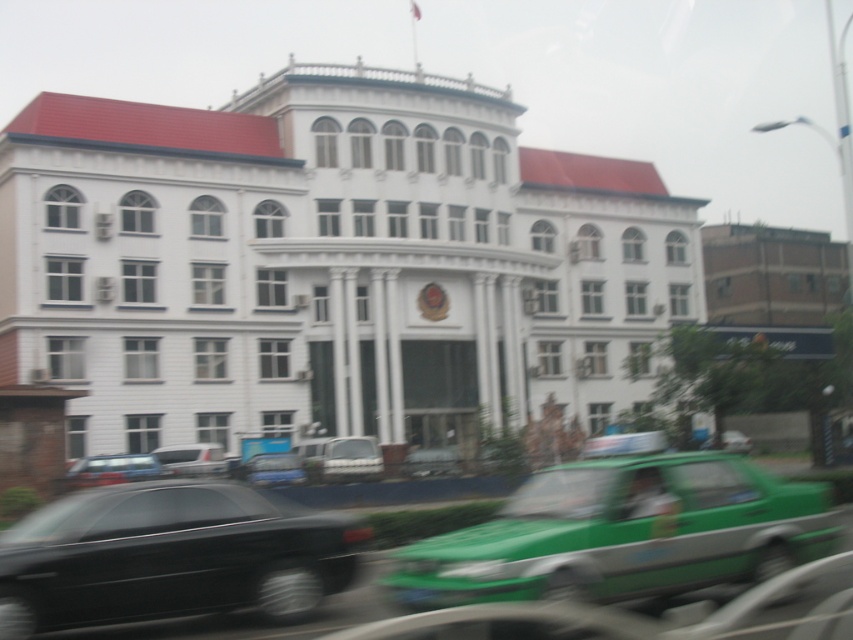
Question: Estimate the real-world distances between objects in this image. Which object is closer to the green matte car at center?

Choices:
 (A) shiny black sedan at lower left
 (B) blue metallic sedan at center
 (C) matte silver sedan at lower left

Answer: (B)

Question: Is green matte taxi at lower right to the right of clear glass window at upper left from the viewer's perspective?

Choices:
 (A) yes
 (B) no

Answer: (A)

Question: Which object is positioned closest to the shiny black sedan at lower left?

Choices:
 (A) blue metallic sedan at center
 (B) white matte van at center
 (C) matte silver sedan at lower left
 (D) green matte car at center

Answer: (C)

Question: From the image, what is the correct spatial relationship of shiny black sedan at lower left in relation to green matte car at center?

Choices:
 (A) above
 (B) below

Answer: (A)

Question: Estimate the real-world distances between objects in this image. Which object is farther from the blue metallic sedan at center?

Choices:
 (A) clear glass window at upper left
 (B) white matte van at center

Answer: (A)

Question: Can you confirm if matte silver sedan at lower left is thinner than clear glass window at upper left?

Choices:
 (A) no
 (B) yes

Answer: (A)